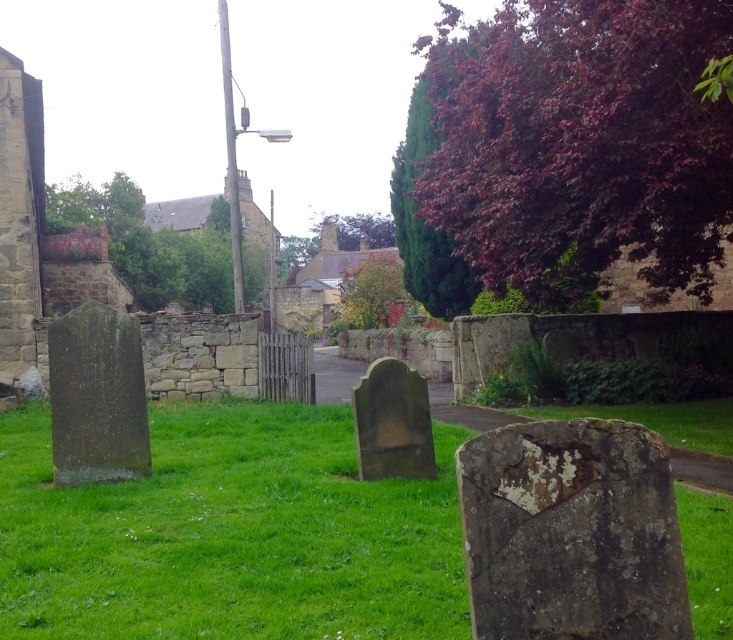
Question: Based on their relative distances, which object is nearer to the smooth gray stone gravestone at center?

Choices:
 (A) granite gravestone at left
 (B) green mossy stone at center

Answer: (A)

Question: Among these points, which one is nearest to the camera?

Choices:
 (A) (122, 442)
 (B) (647, 512)

Answer: (B)

Question: Is green mossy stone at center closer to camera compared to lichen-covered stone at center?

Choices:
 (A) no
 (B) yes

Answer: (A)

Question: Which point is farther to the camera?

Choices:
 (A) granite gravestone at left
 (B) smooth gray stone gravestone at center
 (C) green mossy stone at center

Answer: (C)

Question: Does green mossy stone at center have a larger size compared to lichen-covered stone at center?

Choices:
 (A) no
 (B) yes

Answer: (A)

Question: Can you confirm if green mossy stone at center is positioned to the right of smooth gray stone gravestone at center?

Choices:
 (A) yes
 (B) no

Answer: (B)